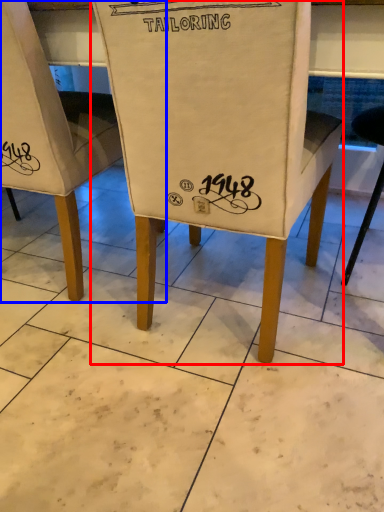
Question: Among these objects, which one is nearest to the camera, chair (highlighted by a red box) or chair (highlighted by a blue box)?

Choices:
 (A) chair
 (B) chair

Answer: (A)